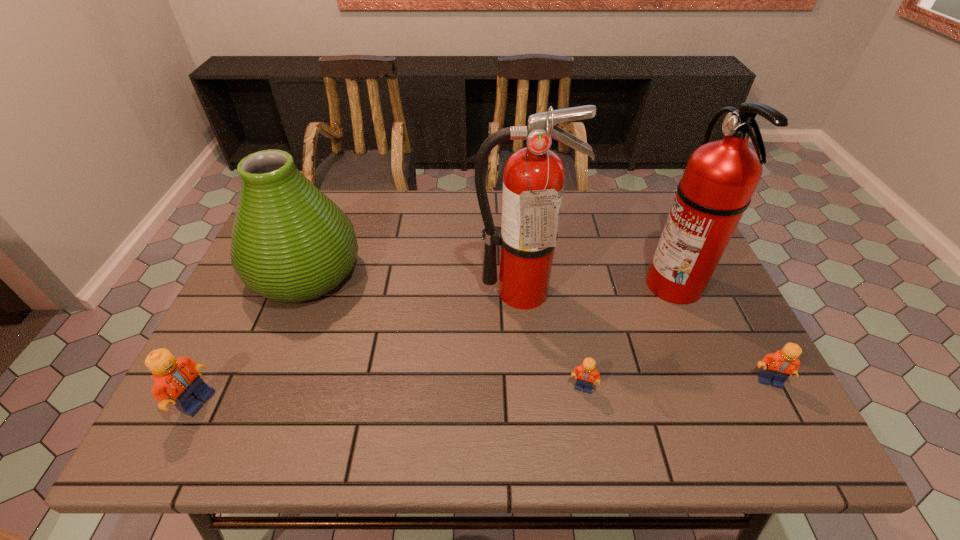
At what (x,y) coordinates should I click in order to perform the action: click on free space located 0.190m on the front of the fourth shortest object. Please return your answer as a coordinate pair (x, y). The height and width of the screenshot is (540, 960). Looking at the image, I should click on (263, 382).

I want to click on vacant space located at the nozzle of the right fire extinguisher, so click(615, 284).

Image resolution: width=960 pixels, height=540 pixels. Identify the location of vacant space located 0.290m at the nozzle of the right fire extinguisher. (537, 284).

In order to click on vacant area situated at the nozzle of the right fire extinguisher in this screenshot , I will do (566, 284).

Locate an element on the screen. free point located 0.110m on the nozzle side of the left fire extinguisher is located at coordinates (526, 346).

The width and height of the screenshot is (960, 540). Identify the location of Lego situated at the left edge. (178, 379).

You are a GUI agent. You are given a task and a screenshot of the screen. Output one action in this format:
    pyautogui.click(x=<x>, y=<y>)
    Task: Click on the vase at the left edge
    The image size is (960, 540).
    Given the screenshot: What is the action you would take?
    [x=290, y=243]

Locate an element on the screen. Lego located at the right edge is located at coordinates pos(777,367).

Locate an element on the screen. fire extinguisher that is at the right edge is located at coordinates (720, 178).

Locate an element on the screen. The width and height of the screenshot is (960, 540). object present at the near left corner is located at coordinates (178, 379).